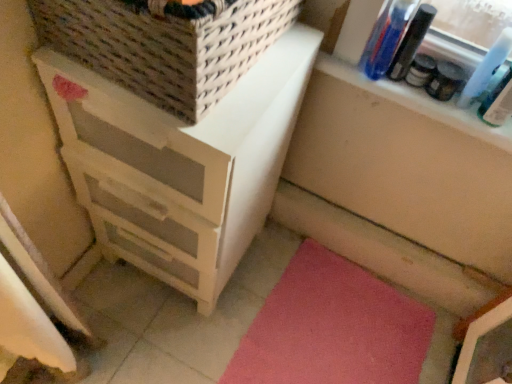
This screenshot has height=384, width=512. I want to click on clear plastic bottles at upper right, so click(x=420, y=103).

What do you see at coordinates (165, 44) in the screenshot? Image resolution: width=512 pixels, height=384 pixels. I see `woven beige basket at upper left` at bounding box center [165, 44].

This screenshot has width=512, height=384. Identify the location of white wood chest of drawers at left. (180, 164).

At what (x,y) coordinates should I click in order to perform the action: click on clear plastic bottles at upper right. Please return your answer as a coordinate pair (x, y). This screenshot has width=512, height=384. Looking at the image, I should click on (420, 103).

Between woven beige basket at upper left and white wood chest of drawers at left, which one has more height?

white wood chest of drawers at left.

From the picture: Is woven beige basket at upper left next to white wood chest of drawers at left?

woven beige basket at upper left and white wood chest of drawers at left are not in contact.

Is point (116, 65) closer or farther from the camera than point (254, 109)?

Point (116, 65) is positioned closer to the camera compared to point (254, 109).

Visually, is woven beige basket at upper left positioned to the left or to the right of white wood chest of drawers at left?

In the image, woven beige basket at upper left appears on the right side of white wood chest of drawers at left.

Does point (509, 119) come in front of point (217, 69)?

No, (509, 119) is behind (217, 69).

From the image's perspective, which is below, clear plastic bottles at upper right or woven beige basket at upper left?

From the image's view, clear plastic bottles at upper right is below.

Is clear plastic bottles at upper right positioned with its back to woven beige basket at upper left?

No.

Looking at this image, is clear plastic bottles at upper right next to woven beige basket at upper left?

clear plastic bottles at upper right and woven beige basket at upper left are not in contact.

Is clear plastic bottles at upper right positioned with its back to pink carpet at lower right?

That's not correct — clear plastic bottles at upper right is not looking away from pink carpet at lower right.

Considering the relative sizes of clear plastic bottles at upper right and pink carpet at lower right in the image provided, is clear plastic bottles at upper right taller than pink carpet at lower right?

Yes, clear plastic bottles at upper right is taller than pink carpet at lower right.

Where is `window sill above the pink carpet at lower right (from the image's perspective)`? The image size is (512, 384). window sill above the pink carpet at lower right (from the image's perspective) is located at coordinates (420, 103).

Considering the relative sizes of clear plastic bottles at upper right and pink carpet at lower right in the image provided, is clear plastic bottles at upper right smaller than pink carpet at lower right?

Yes, clear plastic bottles at upper right is smaller than pink carpet at lower right.

Is white wood chest of drawers at left oriented away from clear plastic bottles at upper right?

white wood chest of drawers at left is not turned away from clear plastic bottles at upper right.

From a real-world perspective, between white wood chest of drawers at left and clear plastic bottles at upper right, who is vertically lower?

white wood chest of drawers at left.

Is white wood chest of drawers at left wider or thinner than clear plastic bottles at upper right?

In the image, white wood chest of drawers at left appears to be wider than clear plastic bottles at upper right.

Is point (172, 213) farther from viewer compared to point (508, 144)?

That is False.

Is clear plastic bottles at upper right in front of white wood chest of drawers at left?

No, it is not.

The height and width of the screenshot is (384, 512). I want to click on window sill positioned vertically above the white wood chest of drawers at left (from a real-world perspective), so click(420, 103).

In terms of size, does clear plastic bottles at upper right appear bigger or smaller than white wood chest of drawers at left?

In the image, clear plastic bottles at upper right appears to be smaller than white wood chest of drawers at left.

From a real-world perspective, is clear plastic bottles at upper right above or below white wood chest of drawers at left?

Clearly, from a real-world perspective, clear plastic bottles at upper right is above white wood chest of drawers at left.

Where is `chest of drawers below the woven beige basket at upper left (from the image's perspective)`? chest of drawers below the woven beige basket at upper left (from the image's perspective) is located at coordinates (180, 164).

Is white wood chest of drawers at left aimed at woven beige basket at upper left?

No, white wood chest of drawers at left does not turn towards woven beige basket at upper left.

Does white wood chest of drawers at left have a greater width compared to woven beige basket at upper left?

Yes, white wood chest of drawers at left is wider than woven beige basket at upper left.

Is the position of white wood chest of drawers at left less distant than that of woven beige basket at upper left?

No, the depth of white wood chest of drawers at left is greater than that of woven beige basket at upper left.

How many degrees apart are the facing directions of woven beige basket at upper left and pink carpet at lower right?

woven beige basket at upper left and pink carpet at lower right are facing 87.6 degrees away from each other.

From the image's perspective, relative to pink carpet at lower right, is woven beige basket at upper left above or below?

Clearly, from the image's perspective, woven beige basket at upper left is above pink carpet at lower right.

Looking at their sizes, would you say woven beige basket at upper left is wider or thinner than pink carpet at lower right?

In the image, woven beige basket at upper left appears to be more narrow than pink carpet at lower right.

Is woven beige basket at upper left at the left side of pink carpet at lower right?

Indeed, woven beige basket at upper left is positioned on the left side of pink carpet at lower right.

Identify the location of chest of drawers on the left of woven beige basket at upper left. (180, 164).

Where is `window sill on the right of woven beige basket at upper left`? window sill on the right of woven beige basket at upper left is located at coordinates [x=420, y=103].

When comparing their distances from clear plastic bottles at upper right, does woven beige basket at upper left or pink carpet at lower right seem further?

pink carpet at lower right.

Consider the image. Which object lies further to the anchor point clear plastic bottles at upper right, woven beige basket at upper left or white wood chest of drawers at left?

woven beige basket at upper left is further to clear plastic bottles at upper right.

Which object lies further to the anchor point pink carpet at lower right, white wood chest of drawers at left or clear plastic bottles at upper right?

The object further to pink carpet at lower right is clear plastic bottles at upper right.

Which object lies further to the anchor point pink carpet at lower right, clear plastic bottles at upper right or white wood chest of drawers at left?

Based on the image, clear plastic bottles at upper right appears to be further to pink carpet at lower right.

From the image, which object appears to be farther from pink carpet at lower right, woven beige basket at upper left or white wood chest of drawers at left?

woven beige basket at upper left is positioned further to the anchor pink carpet at lower right.

Which object lies nearer to the anchor point woven beige basket at upper left, white wood chest of drawers at left or pink carpet at lower right?

white wood chest of drawers at left.

Considering their positions, is woven beige basket at upper left positioned closer to pink carpet at lower right than clear plastic bottles at upper right?

Based on the image, clear plastic bottles at upper right appears to be nearer to pink carpet at lower right.

When comparing their distances from white wood chest of drawers at left, does pink carpet at lower right or clear plastic bottles at upper right seem closer?

clear plastic bottles at upper right.

Locate an element on the screen. The image size is (512, 384). chest of drawers between woven beige basket at upper left and pink carpet at lower right in the vertical direction is located at coordinates (180, 164).

This screenshot has height=384, width=512. In order to click on basket between white wood chest of drawers at left and clear plastic bottles at upper right in the horizontal direction in this screenshot , I will do `click(165, 44)`.

Where is `chest of drawers between clear plastic bottles at upper right and pink carpet at lower right in the up-down direction`? The image size is (512, 384). chest of drawers between clear plastic bottles at upper right and pink carpet at lower right in the up-down direction is located at coordinates (180, 164).

This screenshot has width=512, height=384. I want to click on window sill between woven beige basket at upper left and pink carpet at lower right in the up-down direction, so click(420, 103).